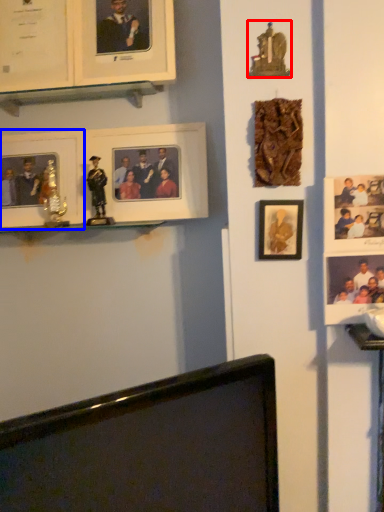
Question: Which object appears closest to the camera in this image, portrait (highlighted by a red box) or picture frame (highlighted by a blue box)?

Choices:
 (A) portrait
 (B) picture frame

Answer: (A)